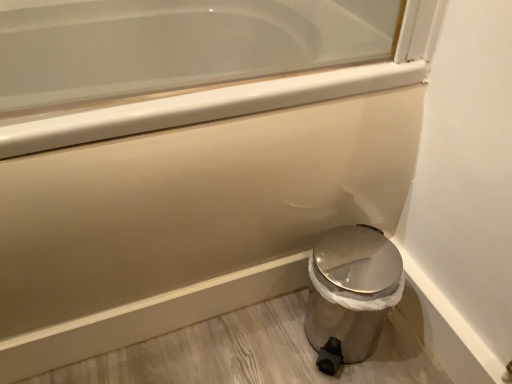
The image size is (512, 384). What are the coordinates of `polished metallic trash can at lower right` in the screenshot? It's located at (351, 290).

What is the approximate height of polished metallic trash can at lower right?

The height of polished metallic trash can at lower right is 10.05 inches.

The width and height of the screenshot is (512, 384). What do you see at coordinates (351, 290) in the screenshot?
I see `polished metallic trash can at lower right` at bounding box center [351, 290].

The width and height of the screenshot is (512, 384). What are the coordinates of `polished metallic trash can at lower right` in the screenshot? It's located at (351, 290).